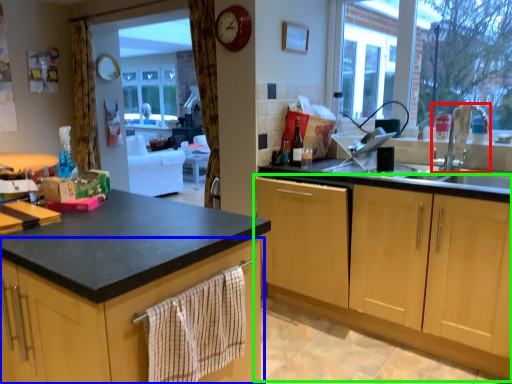
Question: Estimate the real-world distances between objects in this image. Which object is farther from tap (highlighted by a red box), cabinetry (highlighted by a blue box) or cabinetry (highlighted by a green box)?

Choices:
 (A) cabinetry
 (B) cabinetry

Answer: (A)